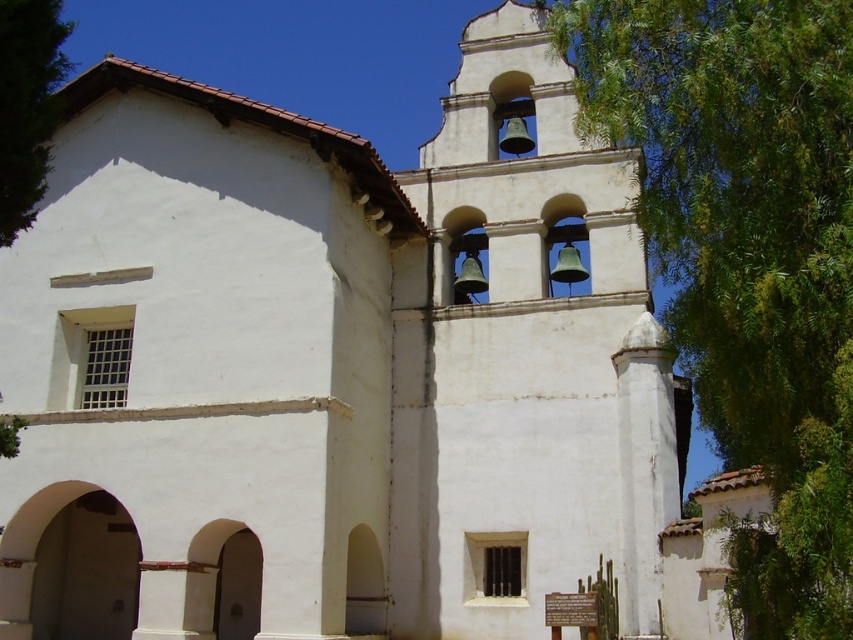
From the picture: You are standing in front of the historic mission building. You notice two points marked on the building. The first point is at coordinates point (x=581, y=106) and the second is at point (x=6, y=182). Which point is closer to you?

Point (x=6, y=182) is closer to you because it is less further to the camera than point (x=581, y=106).